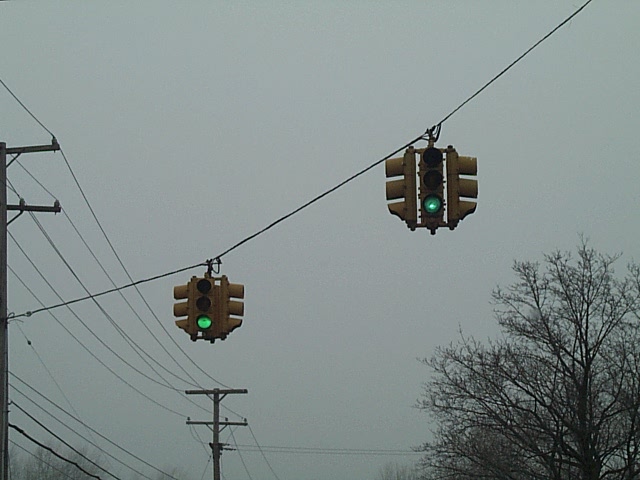
Find the location of a particular element. This screenshot has width=640, height=480. cord is located at coordinates (90, 294).